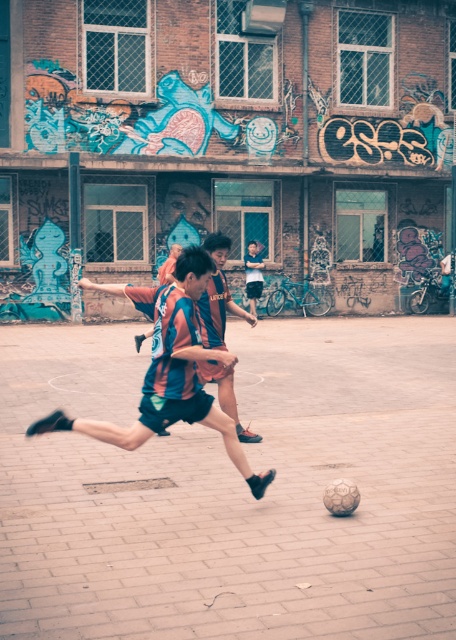
Question: Which is nearer to the striped jersey at center?

Choices:
 (A) light blue denim shorts at center
 (B) multicolored jersey at center

Answer: (B)

Question: Which of the following is the farthest from the observer?

Choices:
 (A) (219, 275)
 (B) (244, 259)

Answer: (B)

Question: Does striped jersey at center appear on the right side of multicolored jersey at center?

Choices:
 (A) yes
 (B) no

Answer: (B)

Question: Does striped jersey at center appear on the left side of light blue denim shorts at center?

Choices:
 (A) no
 (B) yes

Answer: (B)

Question: Which is farther from the striped jersey at center?

Choices:
 (A) light blue denim shorts at center
 (B) multicolored jersey at center

Answer: (A)

Question: In this image, where is striped jersey at center located relative to multicolored jersey at center?

Choices:
 (A) below
 (B) above

Answer: (A)